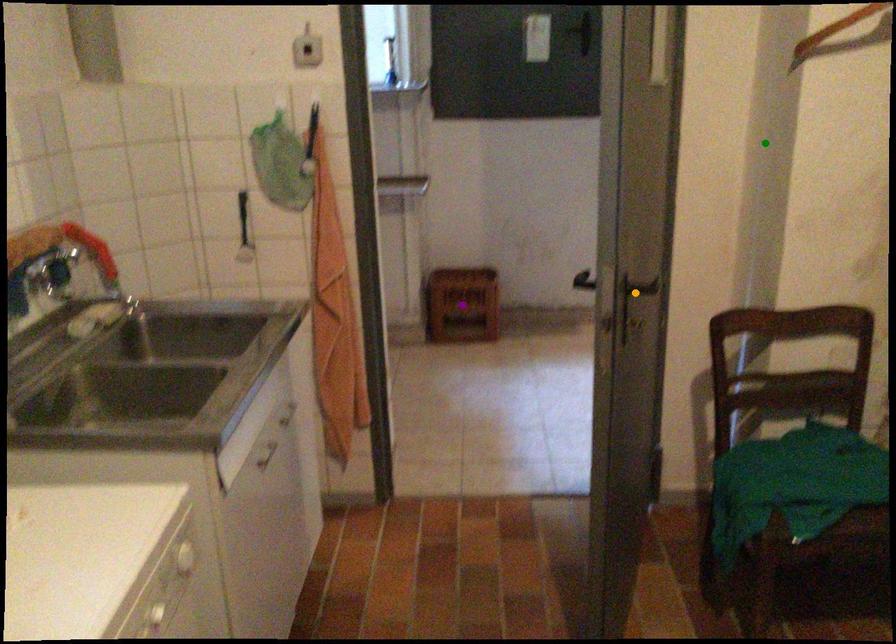
Consider the image. Order these from farthest to nearest:
- purple point
- green point
- orange point

1. purple point
2. green point
3. orange point